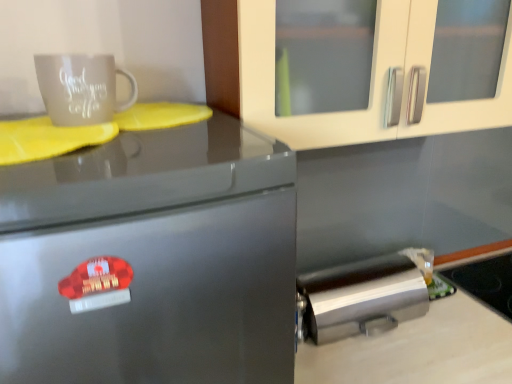
Question: Does satin silver fridge at left have a lesser width compared to brushed metal trash can at lower right?

Choices:
 (A) no
 (B) yes

Answer: (A)

Question: Does satin silver fridge at left come in front of brushed metal trash can at lower right?

Choices:
 (A) yes
 (B) no

Answer: (A)

Question: From a real-world perspective, is satin silver fridge at left on brushed metal trash can at lower right?

Choices:
 (A) no
 (B) yes

Answer: (B)

Question: Is satin silver fridge at left at the left side of brushed metal trash can at lower right?

Choices:
 (A) no
 (B) yes

Answer: (B)

Question: From the image's perspective, is satin silver fridge at left below brushed metal trash can at lower right?

Choices:
 (A) yes
 (B) no

Answer: (A)

Question: Is matte ceramic mug at upper left spatially inside smooth white countertop at lower right, or outside of it?

Choices:
 (A) outside
 (B) inside

Answer: (A)

Question: From a real-world perspective, is matte ceramic mug at upper left positioned above or below smooth white countertop at lower right?

Choices:
 (A) below
 (B) above

Answer: (B)

Question: From the image's perspective, is matte ceramic mug at upper left above or below smooth white countertop at lower right?

Choices:
 (A) above
 (B) below

Answer: (A)

Question: Is matte ceramic mug at upper left bigger or smaller than smooth white countertop at lower right?

Choices:
 (A) small
 (B) big

Answer: (A)

Question: From the image's perspective, is glassy black stove at lower right positioned above or below matte ceramic mug at upper left?

Choices:
 (A) above
 (B) below

Answer: (B)

Question: Visually, is glassy black stove at lower right positioned to the left or to the right of matte ceramic mug at upper left?

Choices:
 (A) right
 (B) left

Answer: (A)

Question: Considering the positions of glassy black stove at lower right and matte ceramic mug at upper left in the image, is glassy black stove at lower right taller or shorter than matte ceramic mug at upper left?

Choices:
 (A) tall
 (B) short

Answer: (B)

Question: Does point (453, 276) appear closer or farther from the camera than point (58, 76)?

Choices:
 (A) closer
 (B) farther

Answer: (B)

Question: Considering their positions, is smooth white countertop at lower right located in front of or behind brushed metal trash can at lower right?

Choices:
 (A) behind
 (B) front

Answer: (B)

Question: Considering the positions of smooth white countertop at lower right and brushed metal trash can at lower right in the image, is smooth white countertop at lower right taller or shorter than brushed metal trash can at lower right?

Choices:
 (A) tall
 (B) short

Answer: (A)